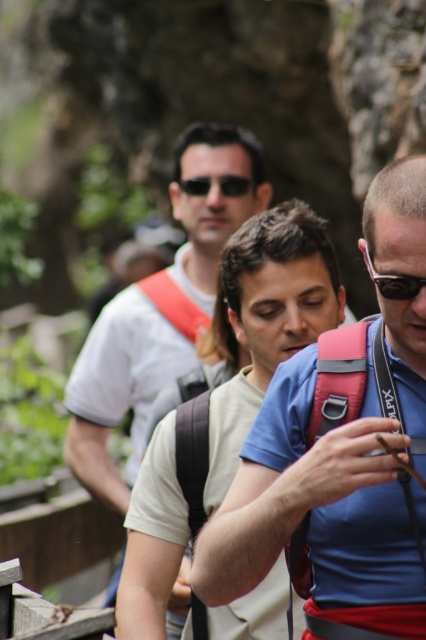
You are a photographer standing in the scene and want to capture a photo where the matte blue shirt at center and the black plastic sunglasses at center right are both clearly visible. Given their height difference, where should you position your camera to ensure both are in frame without cropping either?

The matte blue shirt at center is much taller than the black plastic sunglasses at center right. To capture both without cropping, position the camera at a lower angle so that the shorter black plastic sunglasses at center right is fully visible while still including the taller matte blue shirt at center in the frame.

You are standing at the origin point in the image. Which direction should you move to reach the matte blue shirt at center?

The matte blue shirt at center is located at point (334, 483), so you should move towards the lower right direction from your current position to reach it.

You are a photographer trying to capture the perfect shot of the two pairs of sunglasses in the scene. The black plastic sunglasses at center right and the matte black sunglasses at center are both in view. Which one is located lower in the image?

The black plastic sunglasses at center right is positioned under the matte black sunglasses at center, so it is located lower in the image.